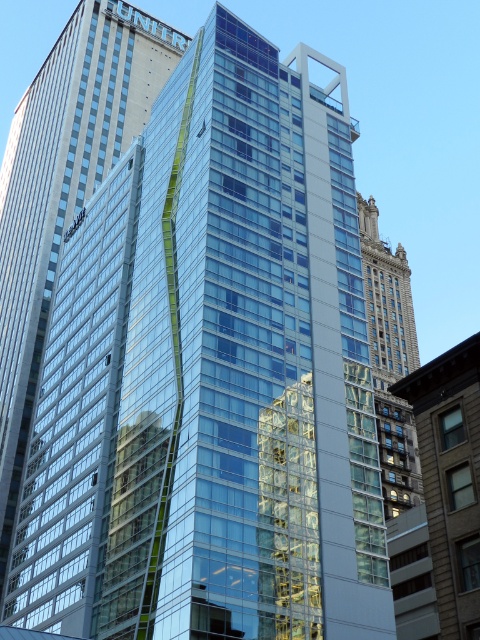
Is transparent glass building at center shorter than brown stone tower at center?

In fact, transparent glass building at center may be taller than brown stone tower at center.

Between transparent glass building at center and brown stone tower at center, which one is positioned higher?

transparent glass building at center

Locate an element on the screen. The image size is (480, 640). transparent glass building at center is located at coordinates (66, 305).